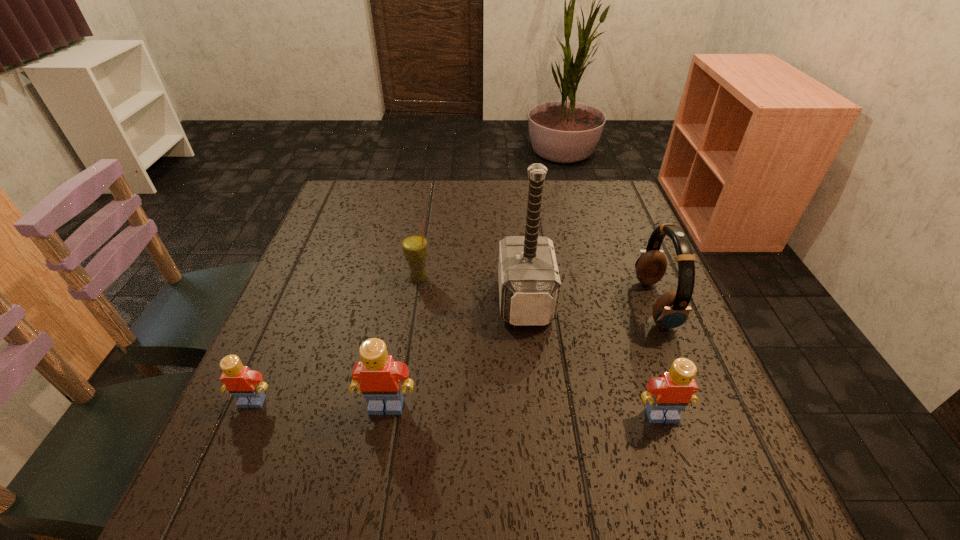
You are a GUI agent. You are given a task and a screenshot of the screen. Output one action in this format:
    pyautogui.click(x=<x>, y=<y>)
    Task: Click on the shortest object
    Image resolution: width=960 pixels, height=540 pixels.
    Given the screenshot: What is the action you would take?
    pyautogui.click(x=246, y=385)

I want to click on the leftmost object, so click(246, 385).

Where is `the second Lego from left to right`? the second Lego from left to right is located at coordinates (377, 375).

Image resolution: width=960 pixels, height=540 pixels. Identify the location of the rightmost Lego. (667, 395).

Find the location of a particular element. Image resolution: width=960 pixels, height=540 pixels. the second tallest Lego is located at coordinates (667, 395).

The image size is (960, 540). Find the location of `headset`. headset is located at coordinates (671, 310).

Identify the location of straw for drinking. The height and width of the screenshot is (540, 960). (414, 246).

Where is `hammer`? This screenshot has height=540, width=960. hammer is located at coordinates (529, 283).

Identify the location of the tallest object. (529, 283).

The width and height of the screenshot is (960, 540). In order to click on free region located on the front-facing side of the second Lego from right to left in this screenshot , I will do point(379,448).